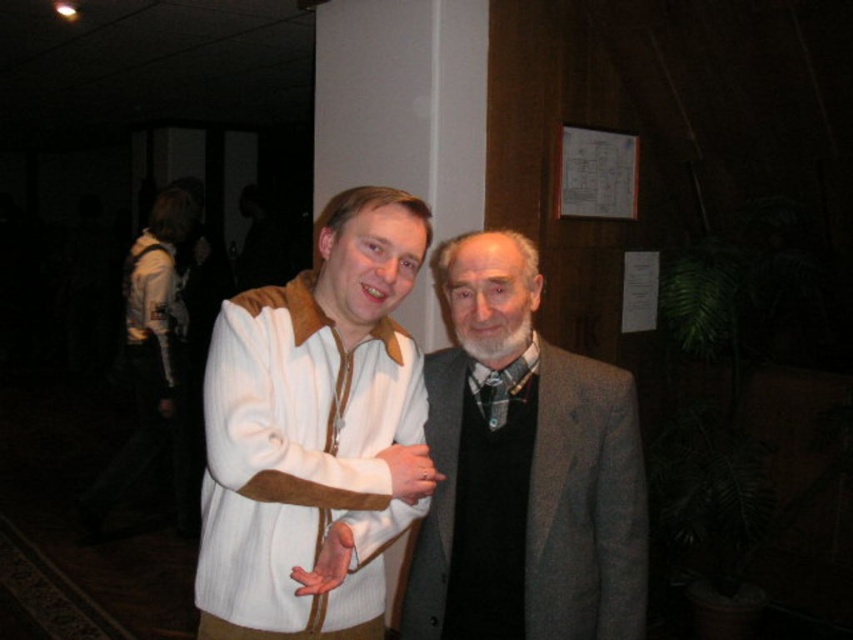
You are a photographer trying to focus on the white textured sweater at center. The camera has a depth of field that can clearly capture objects within 1.2 meters. Will the sweater be in focus?

The white textured sweater at center is 1.26 meters away from the camera. Since the depth of field can only clearly capture objects within 1.2 meters, the sweater will be slightly out of focus.

Looking at this image, you are a photographer trying to focus on the gray wool suit at center. Given that the camera can only focus on objects within a 0.1 unit radius around the point you choose, would selecting the point at coordinates point (524,470) ensure the gray wool suit at center is in focus?

The point (524,470) corresponds to the gray wool suit at center, so yes, selecting this point would place the gray wool suit at center within the camera focus range.